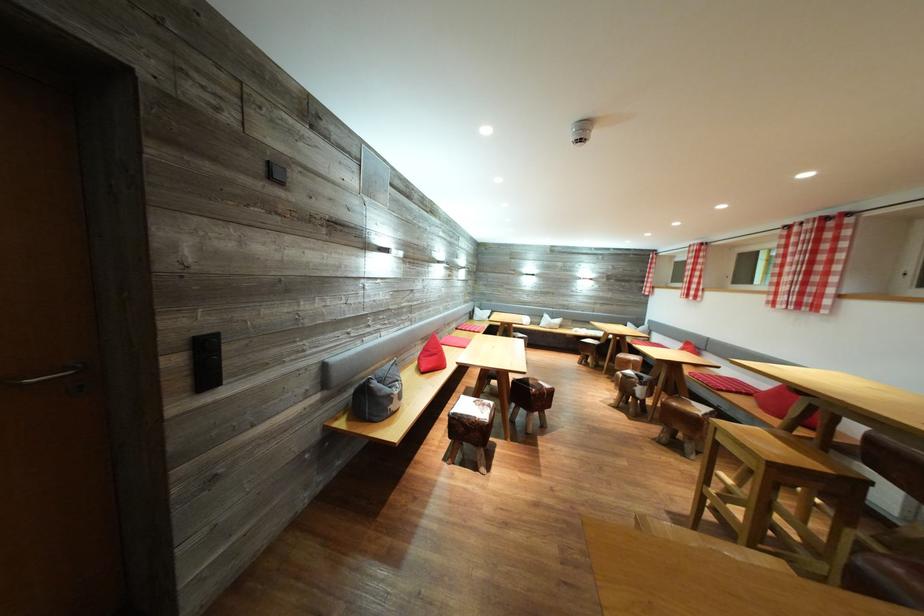
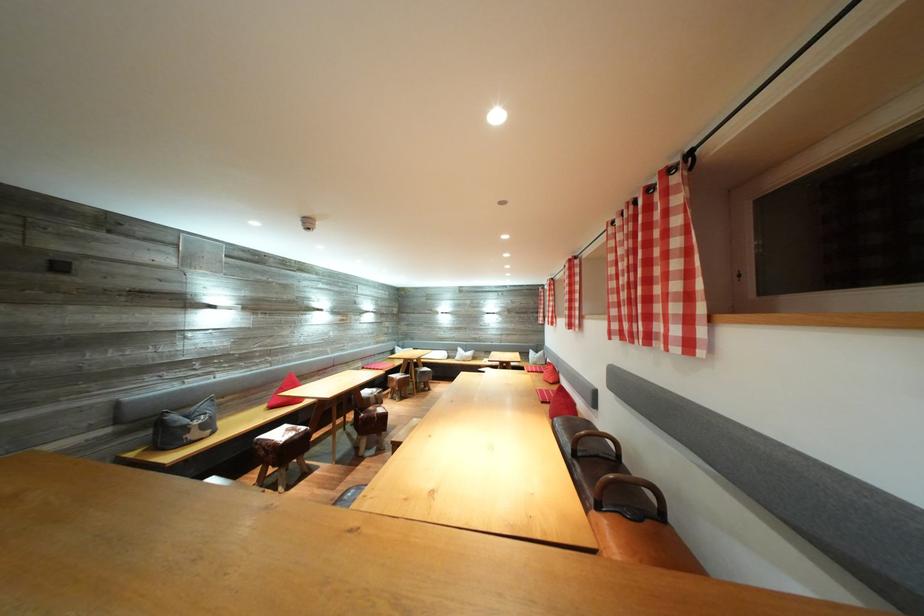
The point at (553, 391) is marked in the first image. Where is the corresponding point in the second image?

(386, 416)